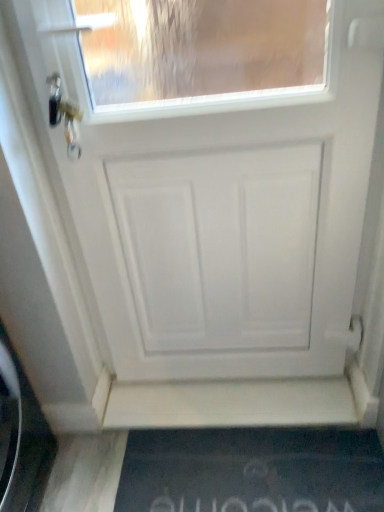
Question: In terms of size, does black rubber doormat at lower center appear bigger or smaller than white matte door at center?

Choices:
 (A) big
 (B) small

Answer: (B)

Question: From their relative heights in the image, would you say black rubber doormat at lower center is taller or shorter than white matte door at center?

Choices:
 (A) tall
 (B) short

Answer: (B)

Question: Is black rubber doormat at lower center wider or thinner than white matte door at center?

Choices:
 (A) thin
 (B) wide

Answer: (B)

Question: In terms of height, does white matte door at center look taller or shorter compared to black rubber doormat at lower center?

Choices:
 (A) short
 (B) tall

Answer: (B)

Question: From a real-world perspective, is white matte door at center above or below black rubber doormat at lower center?

Choices:
 (A) above
 (B) below

Answer: (A)

Question: Do you think white matte door at center is within black rubber doormat at lower center, or outside of it?

Choices:
 (A) outside
 (B) inside

Answer: (A)

Question: From the image's perspective, is white matte door at center above or below black rubber doormat at lower center?

Choices:
 (A) below
 (B) above

Answer: (B)